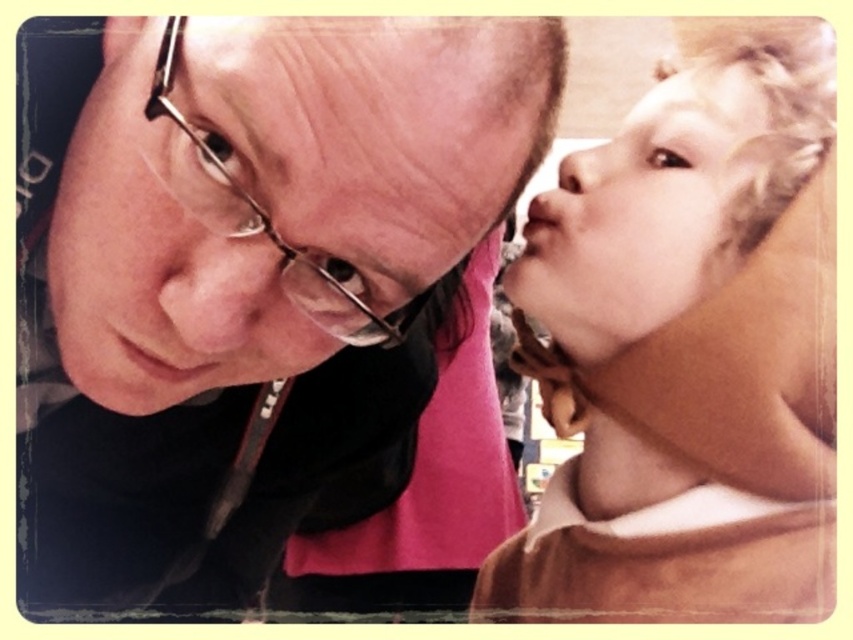
Question: Where is matte black glasses at upper left located in relation to metallic frame glasses at upper left in the image?

Choices:
 (A) above
 (B) below

Answer: (B)

Question: Is blonde hair at right closer to the viewer compared to smooth skin nose at upper right?

Choices:
 (A) yes
 (B) no

Answer: (A)

Question: Which object is farther from the camera taking this photo?

Choices:
 (A) smooth skin nose at upper right
 (B) blonde hair at upper right
 (C) matte black glasses at upper left
 (D) blonde hair at right

Answer: (A)

Question: Which point is closer to the camera?

Choices:
 (A) (717, 138)
 (B) (692, 176)
 (C) (212, 552)
 (D) (303, 292)

Answer: (D)

Question: Where is blonde hair at right located in relation to metallic frame glasses at upper left in the image?

Choices:
 (A) left
 (B) right

Answer: (B)

Question: Which point is closer to the camera taking this photo?

Choices:
 (A) (567, 152)
 (B) (109, 445)
 (C) (714, 440)

Answer: (C)